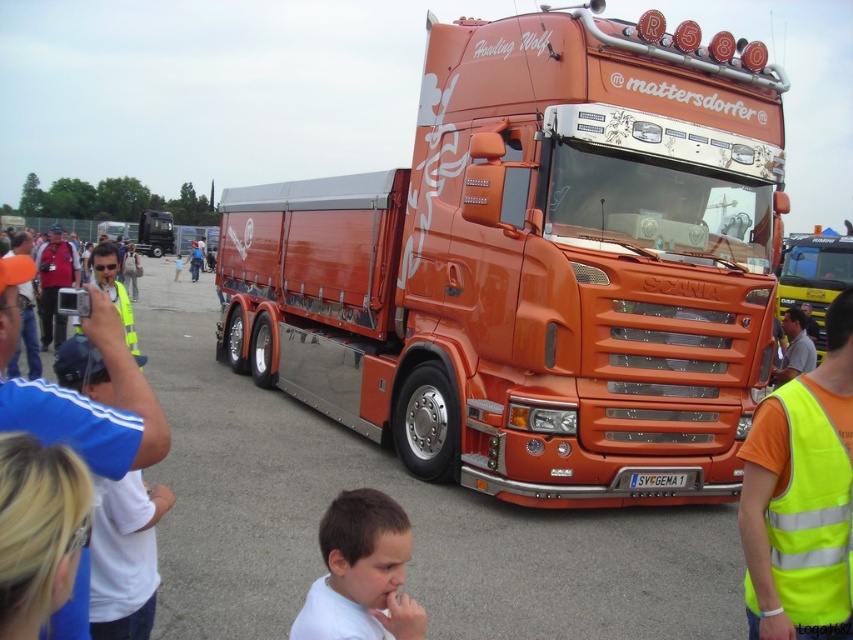
Locate an element on the screen. The width and height of the screenshot is (853, 640). neon yellow reflective safety vest at lower right is located at coordinates (811, 515).

Which of these two, neon yellow reflective safety vest at lower right or white matte shirt at lower center, stands shorter?

With less height is white matte shirt at lower center.

Between point (840, 598) and point (328, 525), which one is positioned behind?

The point (840, 598) is more distant.

Locate an element on the screen. This screenshot has height=640, width=853. neon yellow reflective safety vest at lower right is located at coordinates (811, 515).

Which is behind, point (711, 358) or point (793, 396)?

Positioned behind is point (711, 358).

Looking at this image, is orange metallic truck at center to the left of neon yellow reflective safety vest at lower right from the viewer's perspective?

No, orange metallic truck at center is not to the left of neon yellow reflective safety vest at lower right.

Which is behind, point (375, 212) or point (811, 616)?

Positioned behind is point (375, 212).

You are a GUI agent. You are given a task and a screenshot of the screen. Output one action in this format:
    pyautogui.click(x=<x>, y=<y>)
    Task: Click on the orange metallic truck at center
    This screenshot has width=853, height=640.
    Given the screenshot: What is the action you would take?
    pyautogui.click(x=535, y=266)

How much distance is there between orange metallic truck at center and white matte shirt at lower center?

The distance of orange metallic truck at center from white matte shirt at lower center is 5.50 meters.

From the picture: Who is shorter, orange metallic truck at center or white matte shirt at lower center?

orange metallic truck at center

The height and width of the screenshot is (640, 853). Describe the element at coordinates (535, 266) in the screenshot. I see `orange metallic truck at center` at that location.

You are a GUI agent. You are given a task and a screenshot of the screen. Output one action in this format:
    pyautogui.click(x=<x>, y=<y>)
    Task: Click on the orange metallic truck at center
    This screenshot has width=853, height=640.
    Given the screenshot: What is the action you would take?
    pyautogui.click(x=535, y=266)